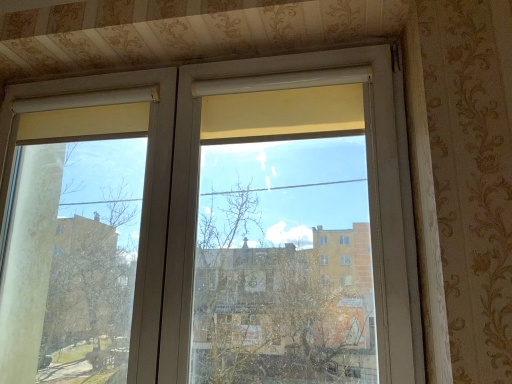
The image size is (512, 384). What do you see at coordinates (198, 192) in the screenshot? I see `transparent glass window at center` at bounding box center [198, 192].

Where is `transparent glass window at center`? The image size is (512, 384). transparent glass window at center is located at coordinates (198, 192).

I want to click on white matte screen door at upper center, so click(x=145, y=176).

What is the approximate width of white matte screen door at upper center?

12.61 centimeters.

Image resolution: width=512 pixels, height=384 pixels. What do you see at coordinates (145, 176) in the screenshot? I see `white matte screen door at upper center` at bounding box center [145, 176].

Find the location of `transparent glass window at center`. transparent glass window at center is located at coordinates (198, 192).

Which is more to the right, white matte screen door at upper center or transparent glass window at center?

Positioned to the right is transparent glass window at center.

Considering the positions of objects white matte screen door at upper center and transparent glass window at center in the image provided, who is behind, white matte screen door at upper center or transparent glass window at center?

white matte screen door at upper center is further from the camera.

Is point (152, 311) closer or farther from the camera than point (400, 209)?

Point (152, 311).

From the image's perspective, between white matte screen door at upper center and transparent glass window at center, which one is located above?

From the image's view, transparent glass window at center is above.

From a real-world perspective, who is located higher, white matte screen door at upper center or transparent glass window at center?

transparent glass window at center is physically above.

Which object is thinner, white matte screen door at upper center or transparent glass window at center?

transparent glass window at center is thinner.

Considering the relative sizes of white matte screen door at upper center and transparent glass window at center in the image provided, is white matte screen door at upper center shorter than transparent glass window at center?

Yes, white matte screen door at upper center is shorter than transparent glass window at center.

Between white matte screen door at upper center and transparent glass window at center, which one has smaller size?

transparent glass window at center is smaller.

Is white matte screen door at upper center inside or outside of transparent glass window at center?

white matte screen door at upper center is spatially positioned inside transparent glass window at center.

Is white matte screen door at upper center with transparent glass window at center?

white matte screen door at upper center and transparent glass window at center are clearly separated.

Is white matte screen door at upper center facing towards transparent glass window at center?

Yes.

What's the angular difference between white matte screen door at upper center and transparent glass window at center's facing directions?

0.000593 degrees.

The height and width of the screenshot is (384, 512). What are the coordinates of `screen door lying on the left of transparent glass window at center` in the screenshot? It's located at (145, 176).

From the picture: Which is more to the right, transparent glass window at center or white matte screen door at upper center?

transparent glass window at center is more to the right.

Relative to white matte screen door at upper center, is transparent glass window at center in front or behind?

Visually, transparent glass window at center is located in front of white matte screen door at upper center.

Considering the points (144, 286) and (22, 95), which point is behind, point (144, 286) or point (22, 95)?

The point (22, 95) is farther from the camera.

From the image's perspective, is transparent glass window at center located above or below white matte screen door at upper center?

Based on their image positions, transparent glass window at center is located above white matte screen door at upper center.

From a real-world perspective, is transparent glass window at center physically above white matte screen door at upper center?

Yes.

From the picture: Between transparent glass window at center and white matte screen door at upper center, which one has larger width?

white matte screen door at upper center is wider.

From the picture: Who is shorter, transparent glass window at center or white matte screen door at upper center?

With less height is white matte screen door at upper center.

Is transparent glass window at center bigger than white matte screen door at upper center?

Incorrect, transparent glass window at center is not larger than white matte screen door at upper center.

Is transparent glass window at center located outside white matte screen door at upper center?

No, most part of transparent glass window at center lies within white matte screen door at upper center.

Is the surface of transparent glass window at center in direct contact with white matte screen door at upper center?

No, transparent glass window at center is not touching white matte screen door at upper center.

Could you tell me if transparent glass window at center is facing white matte screen door at upper center?

Yes, transparent glass window at center is oriented towards white matte screen door at upper center.

Measure the distance from transparent glass window at center to white matte screen door at upper center.

transparent glass window at center is 6.86 inches away from white matte screen door at upper center.

Find the location of a particular element. The width and height of the screenshot is (512, 384). window located above the white matte screen door at upper center (from the image's perspective) is located at coordinates (198, 192).

Where is `screen door located on the left of transparent glass window at center`? This screenshot has width=512, height=384. screen door located on the left of transparent glass window at center is located at coordinates (145, 176).

You are a GUI agent. You are given a task and a screenshot of the screen. Output one action in this format:
    pyautogui.click(x=<x>, y=<y>)
    Task: Click on the screen door lying behind the transparent glass window at center
    This screenshot has width=512, height=384.
    Given the screenshot: What is the action you would take?
    pyautogui.click(x=145, y=176)